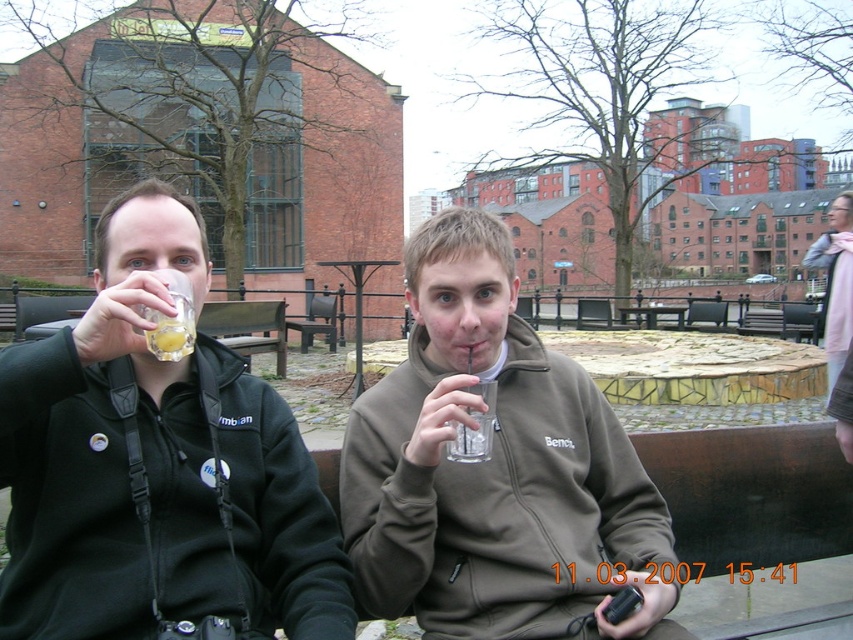
You are standing at the park bench where the matte black jacket at left and the pink fabric scarf at upper right are located. You need to place a 30 feet long banner between them. Will the banner fit between the two objects?

The distance between the matte black jacket at left and the pink fabric scarf at upper right is 28.63 feet. Since the banner is 30 feet long, it is slightly longer than the available space. Therefore, the banner will not fit between them.

You are standing in the park and see two points marked in the image. The first point is at coordinates point (16, 474) and the second is at point (840, 225). Which point is closer to you?

Point (16, 474) is closer to the viewer than point (840, 225).

You are standing in the park and want to place a small flower pot at point (312, 624). If your arm reaches 2 meters, can you reach that point without moving?

The distance of point (312, 624) from viewer is 2.23 meters, so you cannot reach it with a 2 meter arm length.